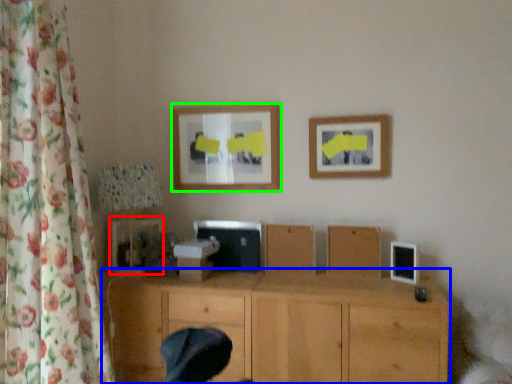
Question: Estimate the real-world distances between objects in this image. Which object is closer to picture frame (highlighted by a red box), wood (highlighted by a blue box) or picture frame (highlighted by a green box)?

Choices:
 (A) wood
 (B) picture frame

Answer: (B)